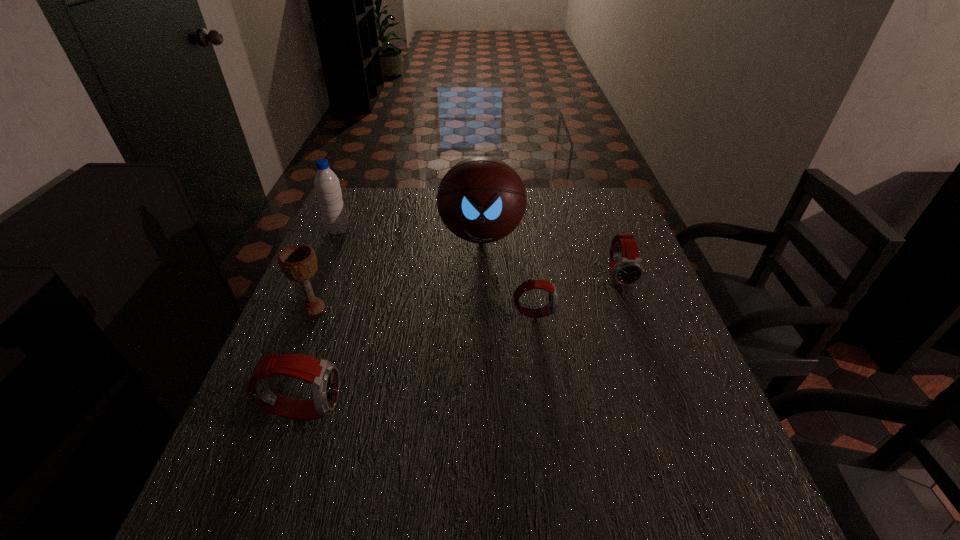
Identify the location of free location located on the face of the shortest object. (584, 313).

The height and width of the screenshot is (540, 960). Identify the location of free space located 0.240m on the face of the farthest watch. (653, 372).

Identify the location of blank space located on the front of the water bottle. This screenshot has width=960, height=540. (304, 313).

Where is `vacant point located 0.270m on the back of the chalice`? Image resolution: width=960 pixels, height=540 pixels. vacant point located 0.270m on the back of the chalice is located at coordinates (344, 234).

In order to click on blank area located 0.310m on the right of the basketball in this screenshot , I will do `click(629, 235)`.

This screenshot has width=960, height=540. In order to click on water bottle that is at the far edge in this screenshot , I will do `click(327, 186)`.

Where is `basketball that is positioned at the far edge`? basketball that is positioned at the far edge is located at coordinates (481, 199).

Where is `object that is positioned at the near edge`? The height and width of the screenshot is (540, 960). object that is positioned at the near edge is located at coordinates (323, 377).

Where is `watch present at the left edge`? This screenshot has height=540, width=960. watch present at the left edge is located at coordinates (323, 377).

Identify the location of water bottle positioned at the left edge. (327, 186).